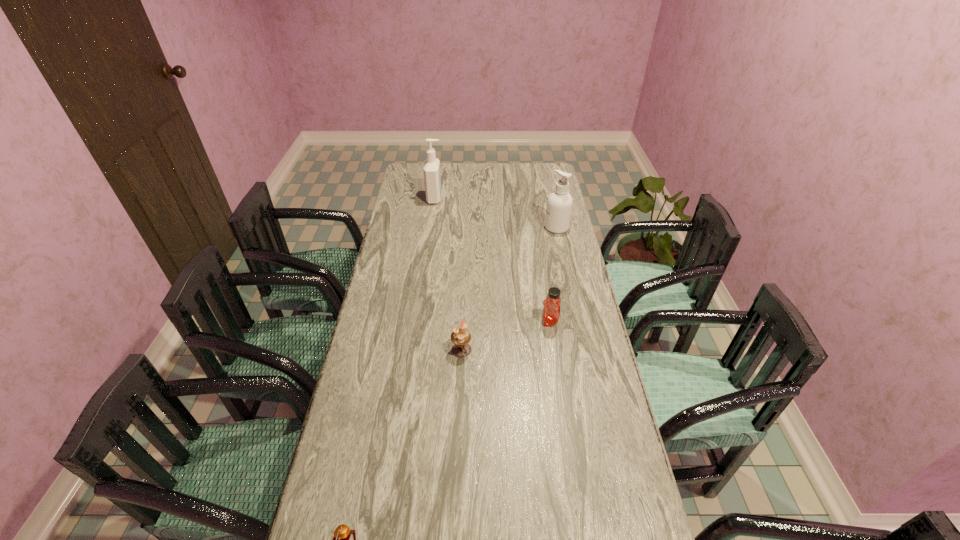
Locate an element on the screen. The width and height of the screenshot is (960, 540). vacant space located on the front label of the right cleansing agent is located at coordinates (472, 227).

You are a GUI agent. You are given a task and a screenshot of the screen. Output one action in this format:
    pyautogui.click(x=<x>, y=<y>)
    Task: Click on the free space located 0.140m on the front label of the right cleansing agent
    This screenshot has height=540, width=960.
    Given the screenshot: What is the action you would take?
    pyautogui.click(x=513, y=227)

Image resolution: width=960 pixels, height=540 pixels. I want to click on vacant space situated on the front label of the honey, so click(448, 321).

Identify the location of vacant space located 0.340m on the front label of the honey. (443, 321).

Where is `blank space located 0.200m on the front label of the honey`? The width and height of the screenshot is (960, 540). blank space located 0.200m on the front label of the honey is located at coordinates (483, 321).

Identify the location of free space located on the back of the third object from right to left. (465, 274).

Find the location of a particular element. The image size is (960, 540). object at the left edge is located at coordinates (432, 177).

At what (x,y) coordinates should I click in order to perform the action: click on cleansing agent located in the right edge section of the desktop. Please return your answer as a coordinate pair (x, y). This screenshot has width=960, height=540. Looking at the image, I should click on (559, 205).

The width and height of the screenshot is (960, 540). Identify the location of honey located in the right edge section of the desktop. (551, 311).

At what (x,y) coordinates should I click in order to perform the action: click on vacant area at the far edge. Please return your answer as a coordinate pair (x, y). The image size is (960, 540). Looking at the image, I should click on (516, 184).